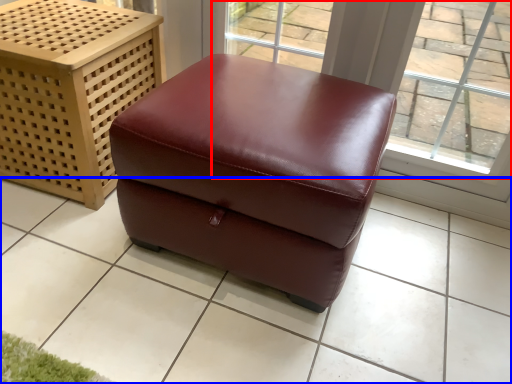
Question: Which of the following is the farthest to the observer, window (highlighted by a red box) or tile (highlighted by a blue box)?

Choices:
 (A) window
 (B) tile

Answer: (A)